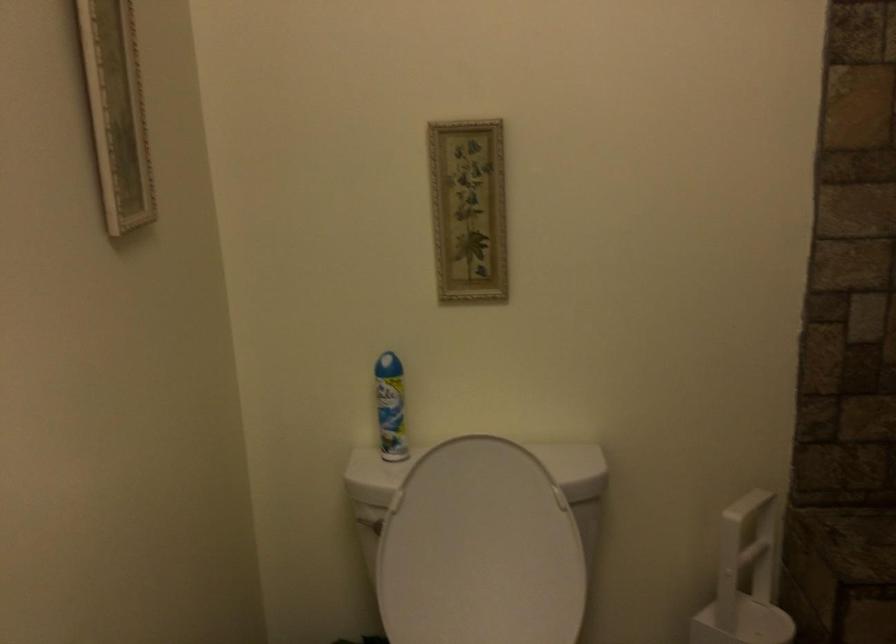
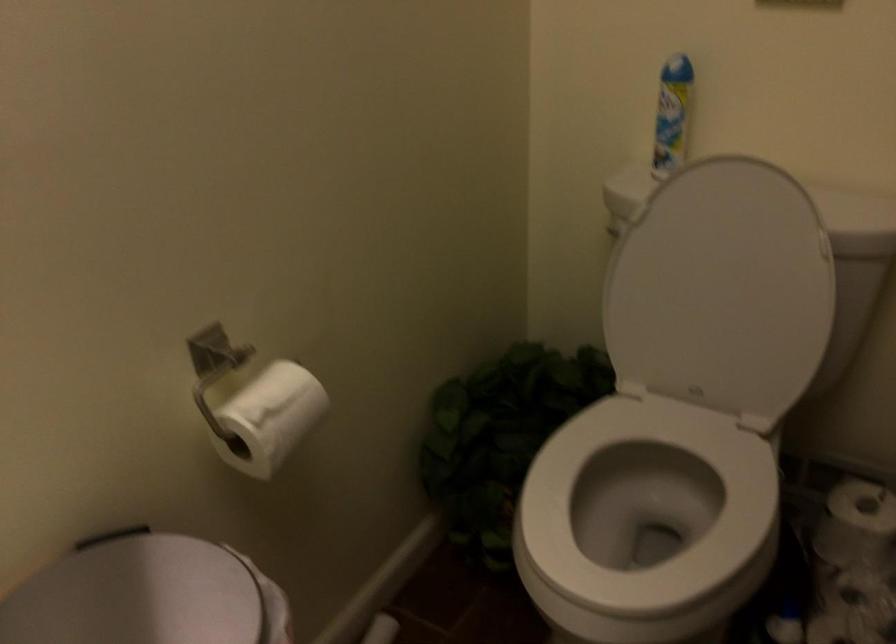
Question: I am providing you with two images of the same scene from different viewpoints. Which of the following objects are not visible in image2?

Choices:
 (A) aerosol can
 (B) white toilet paper roll
 (C) white toilet lid
 (D) none of these

Answer: (D)